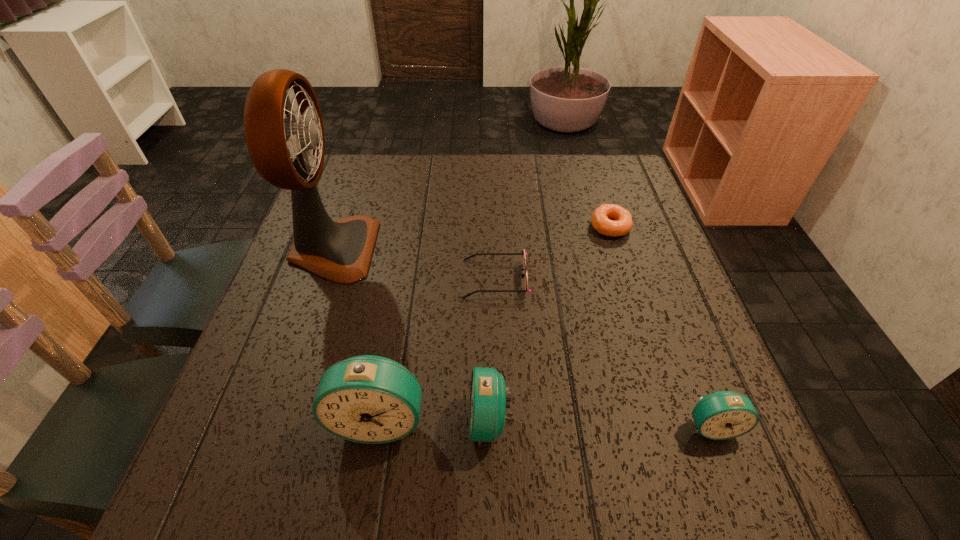
What are the coordinates of `vacant space located on the front-facing side of the second tallest alarm clock` in the screenshot? It's located at (246, 421).

What are the coordinates of `vacant space located on the front-facing side of the second tallest alarm clock` in the screenshot? It's located at (439, 421).

Locate an element on the screen. Image resolution: width=960 pixels, height=540 pixels. free space located on the front-facing side of the second tallest alarm clock is located at coordinates (240, 421).

Locate an element on the screen. This screenshot has width=960, height=540. blank space located on the bridge of the sunglasses is located at coordinates (289, 279).

Where is `free space located on the bridge of the sunglasses`? Image resolution: width=960 pixels, height=540 pixels. free space located on the bridge of the sunglasses is located at coordinates (289, 279).

Locate an element on the screen. This screenshot has width=960, height=540. vacant space located on the bridge of the sunglasses is located at coordinates (383, 279).

You are a GUI agent. You are given a task and a screenshot of the screen. Output one action in this format:
    pyautogui.click(x=<x>, y=<y>)
    Task: Click on the vacant region located on the front-facing side of the fan
    
    Given the screenshot: What is the action you would take?
    pyautogui.click(x=395, y=249)

Image resolution: width=960 pixels, height=540 pixels. What are the coordinates of `vacant space situated on the left of the doughnut` in the screenshot? It's located at (468, 226).

This screenshot has width=960, height=540. What are the coordinates of `object that is at the left edge` in the screenshot? It's located at (289, 154).

At what (x,y) coordinates should I click in order to perform the action: click on alarm clock located in the right edge section of the desktop. Please return your answer as a coordinate pair (x, y). The height and width of the screenshot is (540, 960). Looking at the image, I should click on (722, 415).